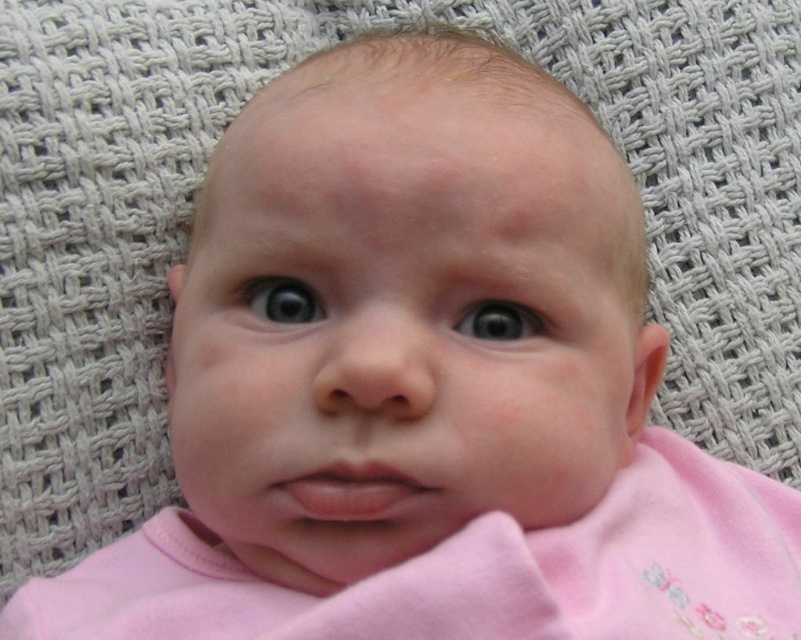
Question: Does blue glossy eye at center appear on the right side of gray matte eye at center?

Choices:
 (A) no
 (B) yes

Answer: (A)

Question: Among these points, which one is farthest from the camera?

Choices:
 (A) (469, 328)
 (B) (256, 296)

Answer: (B)

Question: Among these objects, which one is nearest to the camera?

Choices:
 (A) gray matte eye at center
 (B) blue glossy eye at center

Answer: (A)

Question: Is blue glossy eye at center positioned behind gray matte eye at center?

Choices:
 (A) yes
 (B) no

Answer: (A)

Question: Is blue glossy eye at center to the left of gray matte eye at center from the viewer's perspective?

Choices:
 (A) no
 (B) yes

Answer: (B)